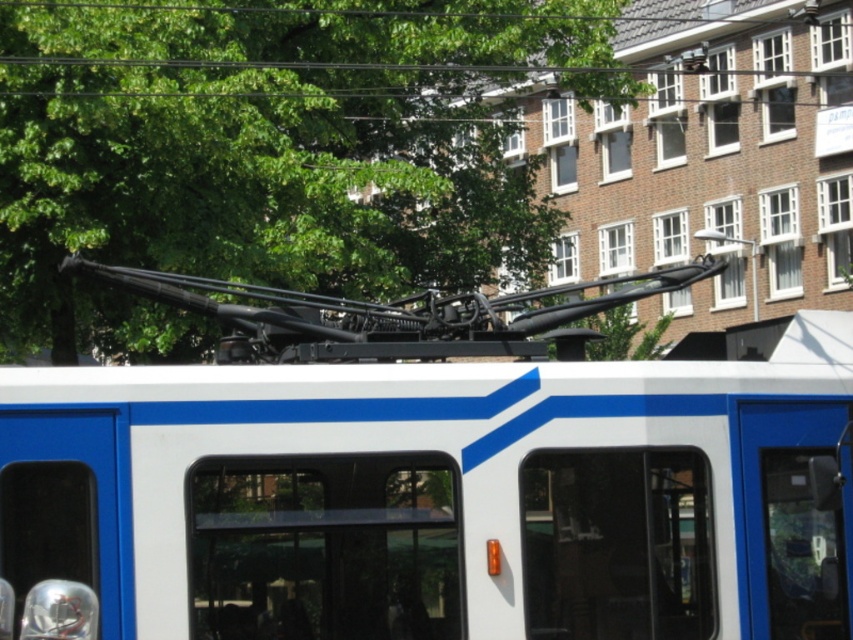
How distant is white matte train at center from green leafy tree at upper center?

white matte train at center and green leafy tree at upper center are 13.81 meters apart from each other.

Is point (45, 392) more distant than point (167, 193)?

No, it is in front of (167, 193).

The height and width of the screenshot is (640, 853). I want to click on white matte train at center, so click(x=426, y=477).